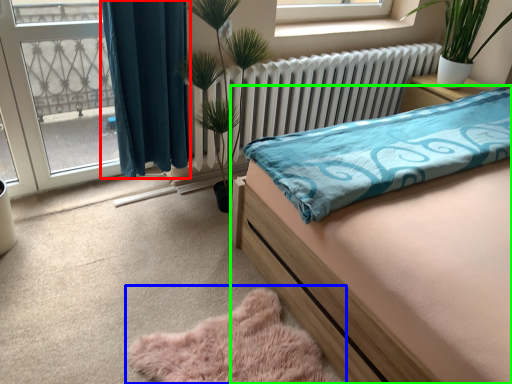
Question: Which is farther away from curtain (highlighted by a red box)? plain (highlighted by a blue box) or bed (highlighted by a green box)?

Choices:
 (A) plain
 (B) bed

Answer: (A)